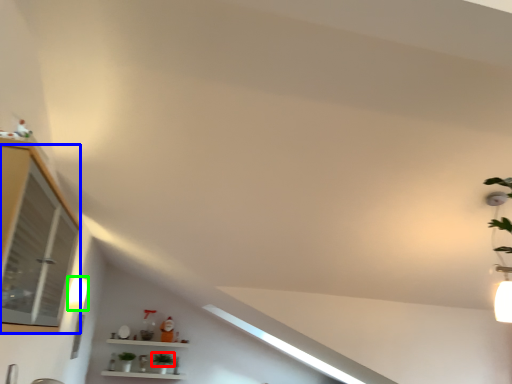
Question: Which object is the closest to the plant (highlighted by a red box)? Choose among these: window (highlighted by a blue box) or light fixture (highlighted by a green box).

Choices:
 (A) window
 (B) light fixture

Answer: (B)